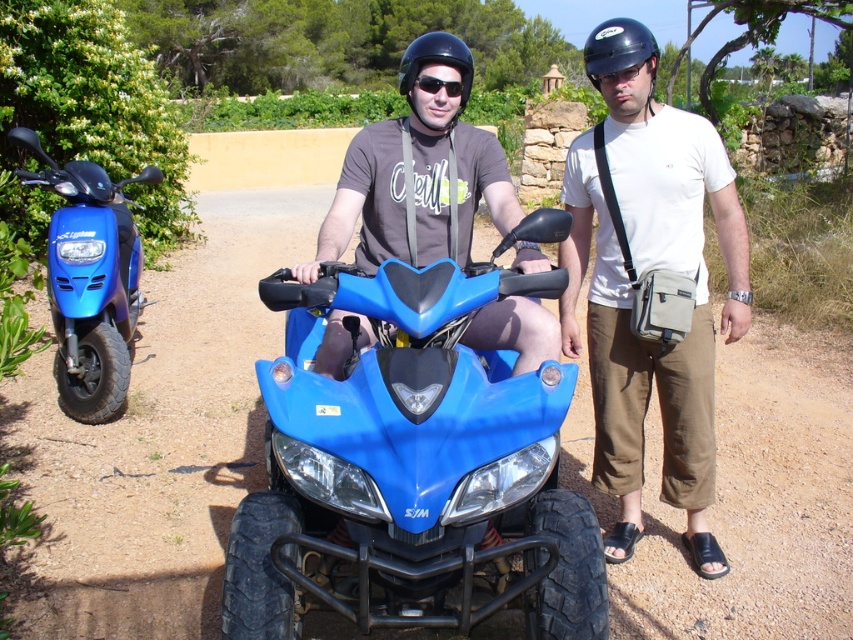
You are planning to pack your gear into a storage container that can only hold items that take up the same amount of space as the blue glossy scooter at left. Can the matte black helmet at center fit into this container?

The matte black helmet at center occupies less space than the blue glossy scooter at left, so it can fit into the container designed for the scooter.

Looking at this image, you are a photographer trying to capture a clear shot of both the blue glossy quad bike at center and the blue glossy scooter at left. Since you want both in focus, which object should you position your camera closer to?

The blue glossy quad bike at center is closer to the viewer than the blue glossy scooter at left, so positioning the camera closer to the blue glossy quad bike at center will help keep both objects in focus.

You are planning to park both the blue glossy quad bike at center and the blue glossy scooter at left in a narrow garage. Which vehicle should you park first to ensure both fit inside?

You should park the blue glossy scooter at left first because the blue glossy quad bike at center might be wider and requires more space, so placing it first ensures there is enough room for both vehicles.